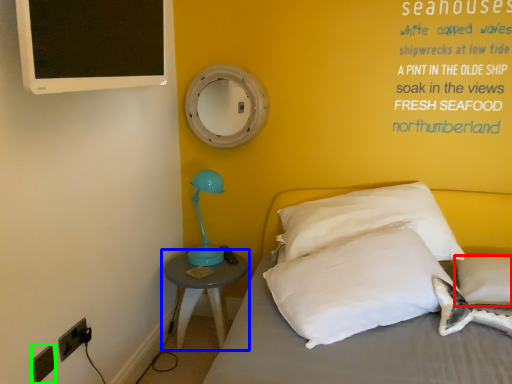
Question: Considering the real-world distances, which object is farthest from pillow (highlighted by a red box)? nightstand (highlighted by a blue box) or electric outlet (highlighted by a green box)?

Choices:
 (A) nightstand
 (B) electric outlet

Answer: (B)